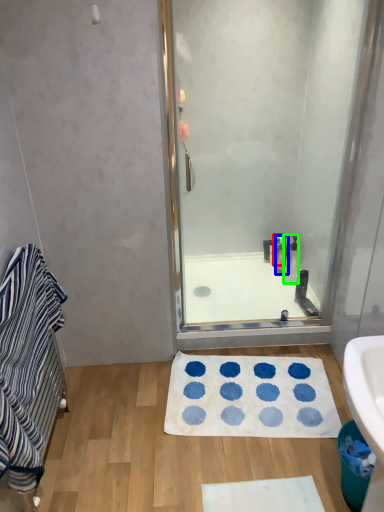
Question: Based on their relative distances, which object is farther from toiletry (highlighted by a red box)? Choose from toiletry (highlighted by a blue box) and toiletry (highlighted by a green box).

Choices:
 (A) toiletry
 (B) toiletry

Answer: (B)